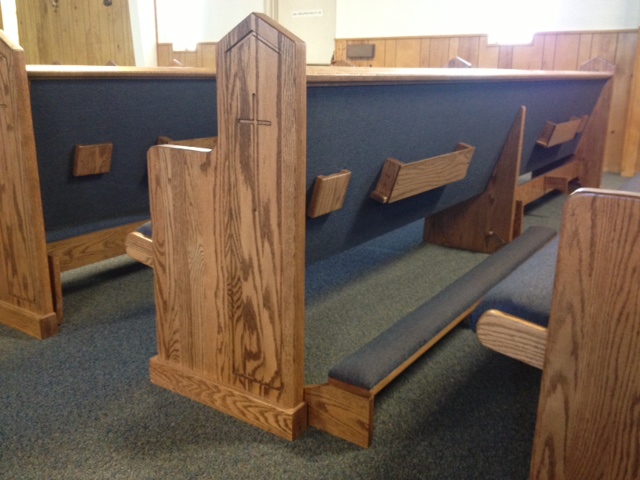
Where is `kneel cushion`? kneel cushion is located at coordinates (400, 339).